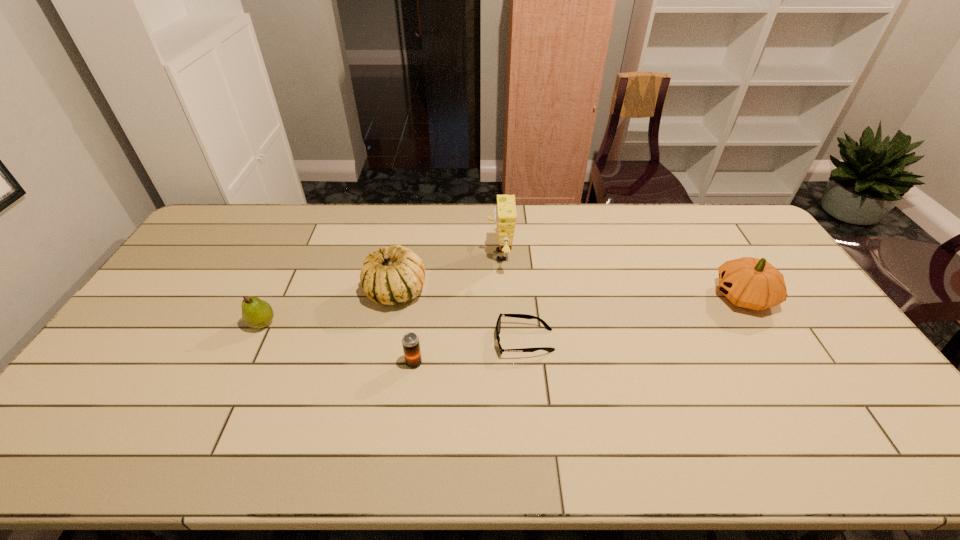
This screenshot has height=540, width=960. I want to click on vacant space that's between the sunglasses and the beer can, so click(x=469, y=352).

I want to click on free space between the beer can and the sunglasses, so click(469, 352).

Where is `vacant area that lies between the beer can and the leftmost object`? vacant area that lies between the beer can and the leftmost object is located at coordinates (338, 343).

Identify which object is the fifth nearest to the beer can. Please provide its 2D coordinates. Your answer should be formatted as a tuple, i.e. [(x, y)], where the tuple contains the x and y coordinates of a point satisfying the conditions above.

[(752, 283)]

I want to click on object that stands as the third closest to the right gourd, so click(x=410, y=341).

The width and height of the screenshot is (960, 540). Identify the location of free space in the image that satisfies the following two spatial constraints: 1. on the side of the right gourd with the carved face; 2. on the front side of the beer can. (783, 363).

Identify the location of free space that satisfies the following two spatial constraints: 1. on the back side of the left gourd; 2. on the left side of the leftmost object. point(277,292).

Find the location of a particular element. The width and height of the screenshot is (960, 540). blank area in the image that satisfies the following two spatial constraints: 1. on the front-facing side of the sponge; 2. on the front side of the pear is located at coordinates (503, 323).

Find the location of a particular element. The width and height of the screenshot is (960, 540). blank space that satisfies the following two spatial constraints: 1. on the front-facing side of the sunglasses; 2. on the front side of the beer can is located at coordinates (527, 363).